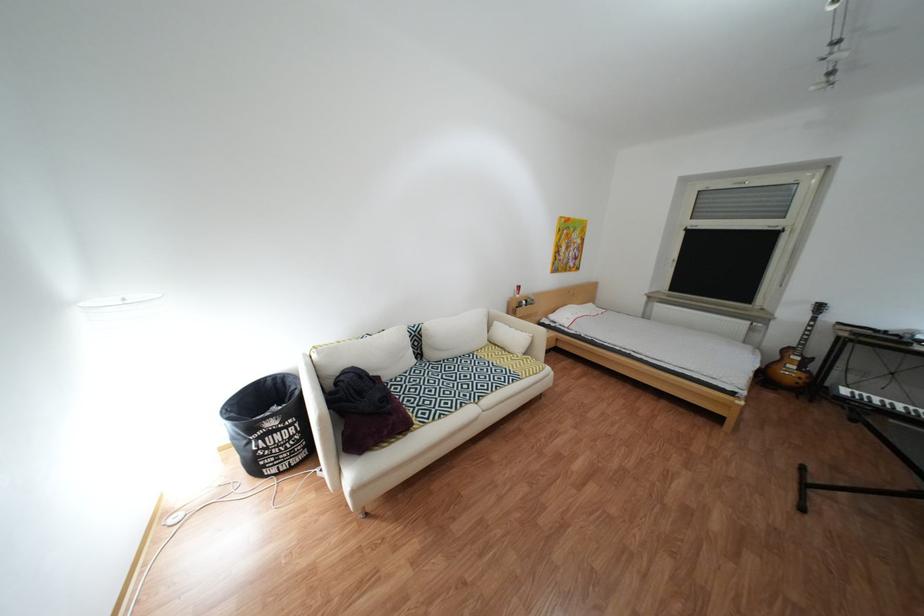
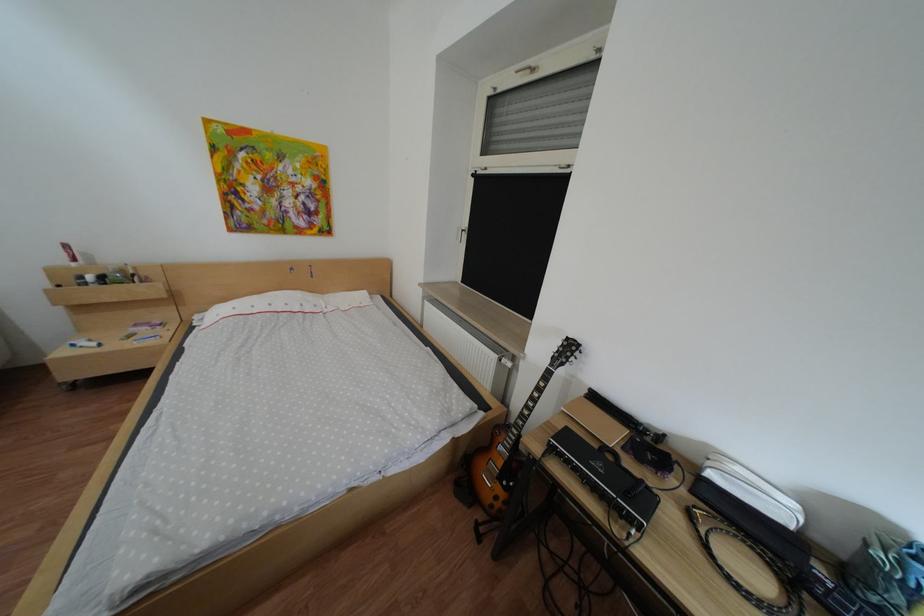
Which direction would the cameraman need to move to produce the second image?

The cameraman walked toward right, forward.